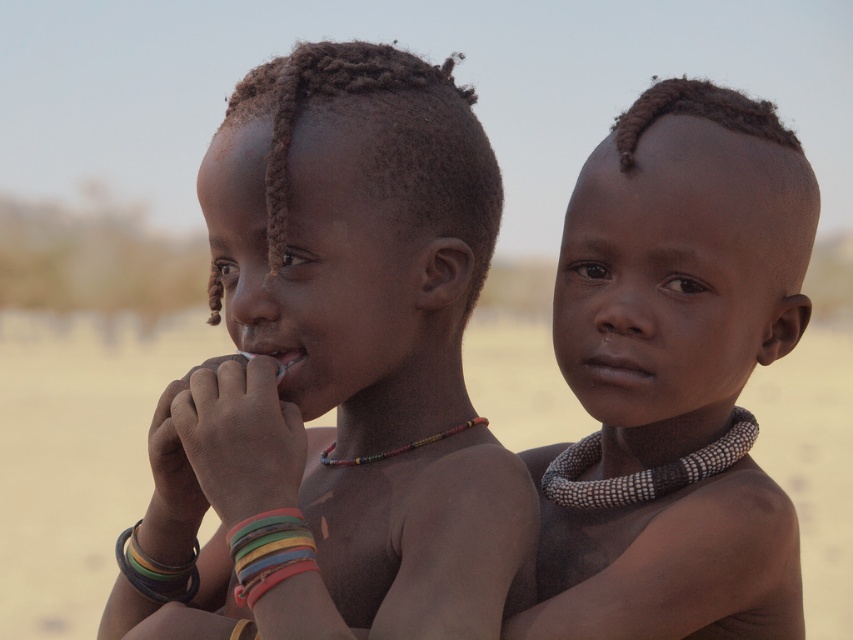
Question: Is dry skin at center smaller than matte white teeth at center?

Choices:
 (A) yes
 (B) no

Answer: (B)

Question: Which of the following is the closest to the observer?

Choices:
 (A) (519, 480)
 (B) (267, 556)
 (C) (592, 355)

Answer: (B)

Question: Observing the image, what is the correct spatial positioning of dirt field at center in reference to multicolored rubber bracelets at lower left?

Choices:
 (A) right
 (B) left

Answer: (A)

Question: Which point is closer to the camera taking this photo?

Choices:
 (A) tap(567, 493)
 (B) tap(357, 465)
 (C) tap(273, 516)
 (D) tap(32, 531)

Answer: (C)

Question: Is smooth skin boy at center smaller than dirt field at center?

Choices:
 (A) no
 (B) yes

Answer: (B)

Question: Which object appears closest to the camera in this image?

Choices:
 (A) multicolored beaded necklace at center
 (B) dirt field at center
 (C) white beaded necklace at center

Answer: (A)